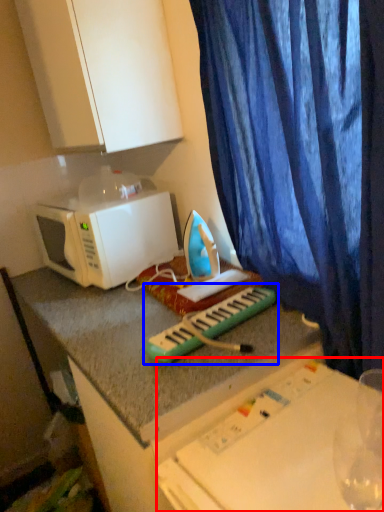
Question: Which object is further to the camera taking this photo, table (highlighted by a red box) or musical keyboard (highlighted by a blue box)?

Choices:
 (A) table
 (B) musical keyboard

Answer: (B)